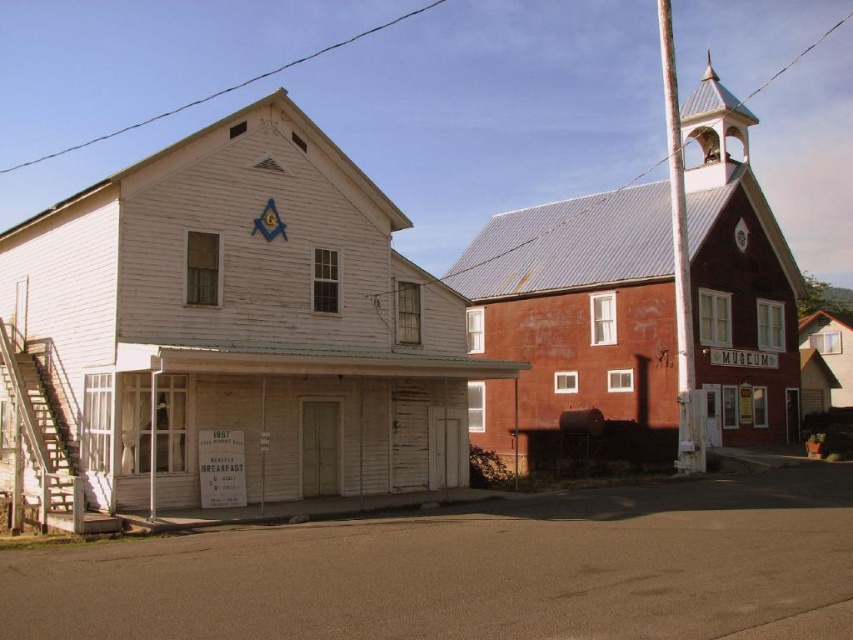
You are a visitor standing in the middle of the street between the two chapels. You want to take a photo of both the white wooden chapel at left and the rustic wood chapel at right without any obstructions. Which direction should you face to ensure both are visible in the frame?

You should face towards the white wooden chapel at left because it is in front of the rustic wood chapel at right, so positioning yourself in front of the white wooden chapel at left will allow both to be visible without obstruction.

You are standing in the middle of the street facing both buildings. You want to take a photo that includes both the white wooden chapel at left and the red brick building on the right. Your camera has a maximum zoom of 50 meters. Will you be able to capture both buildings in one shot without moving?

The distance between the white wooden chapel at left and the viewer is 15.39 meters. Since your camera can zoom up to 50 meters, which is greater than the distance, you can capture both buildings in one shot without moving.